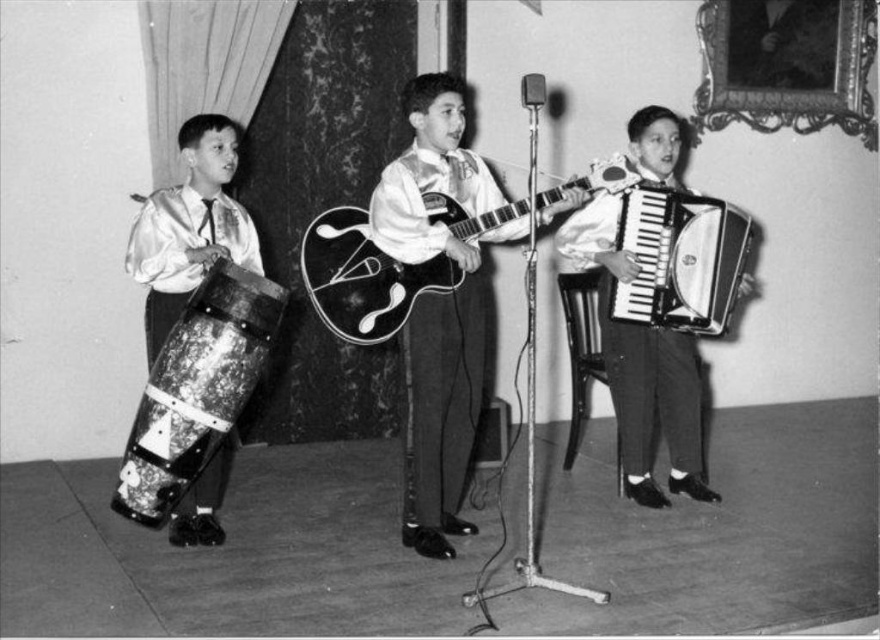
You are a photographer trying to capture a closeup of the shiny black guitar at center and the glossy wood guitar at center. Which guitar should you focus on first if you want to prioritize the taller one?

The shiny black guitar at center is much taller than the glossy wood guitar at center, so you should focus on the shiny black guitar at center first.

You are a stagehand setting up a narrow platform between the shiny silver accordion at center and the distressed wood drum at left. The platform must be 1.2 meters wide. Can you fit it between them?

The shiny silver accordion at center might be wider than the distressed wood drum at left, so the platform might not fit if the accordion is wider than 1.2 meters. Check the actual width of the accordion first.